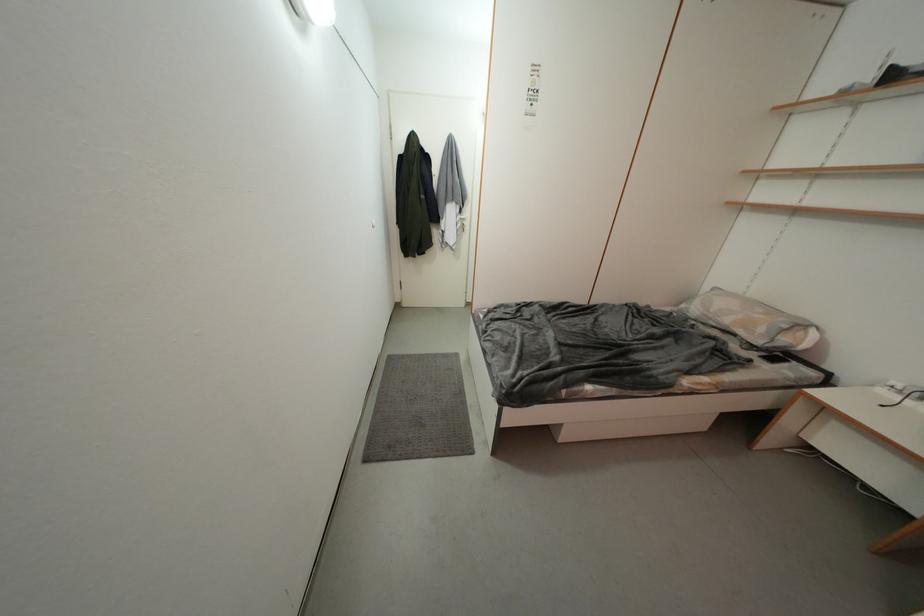
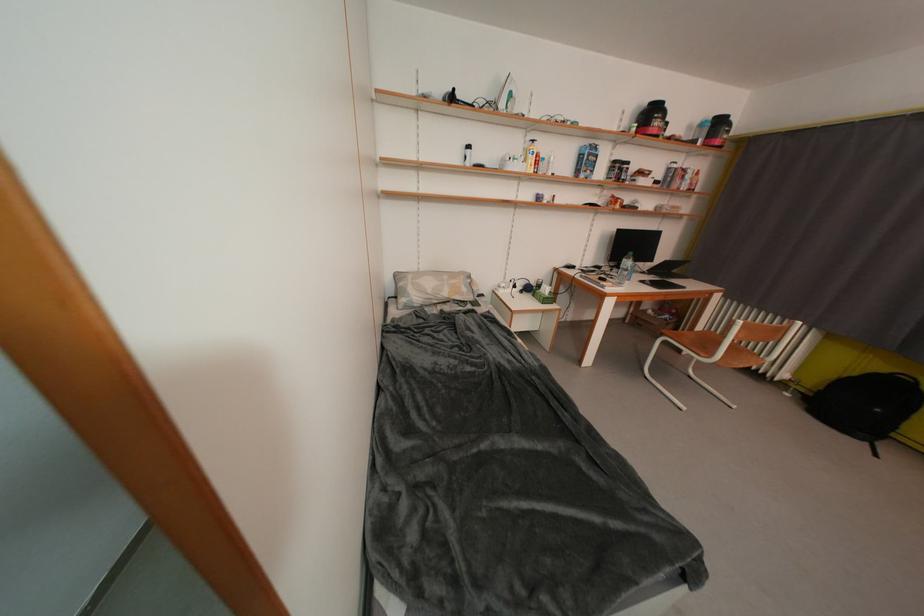
The point at [769,333] is marked in the first image. Where is the corresponding point in the second image?

(471, 293)